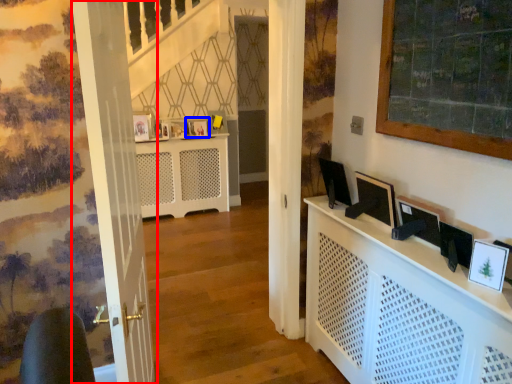
Question: Which point is closer to the camera, door (highlighted by a red box) or picture frame (highlighted by a blue box)?

Choices:
 (A) door
 (B) picture frame

Answer: (A)